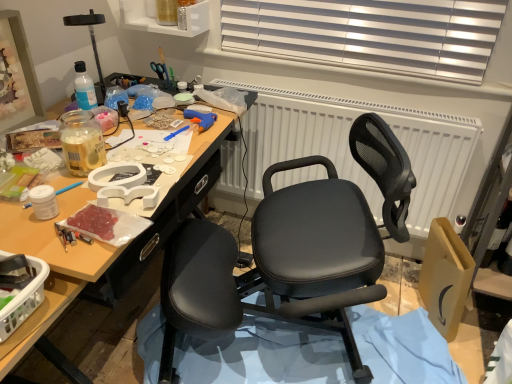
The image size is (512, 384). I want to click on free space above white textured radiator at center (from a real-world perspective), so click(350, 92).